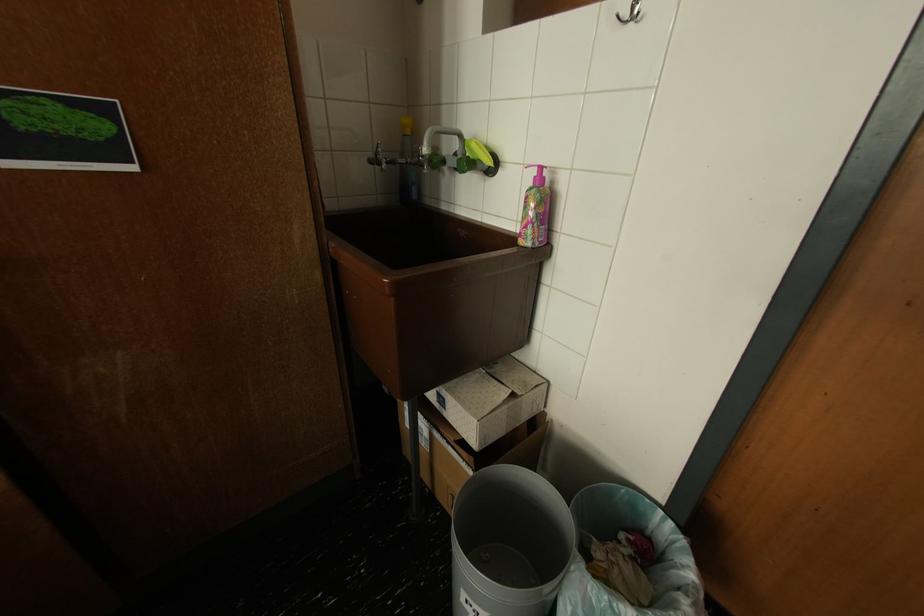
Describe the element at coordinates (478, 151) in the screenshot. I see `the yellow sponge` at that location.